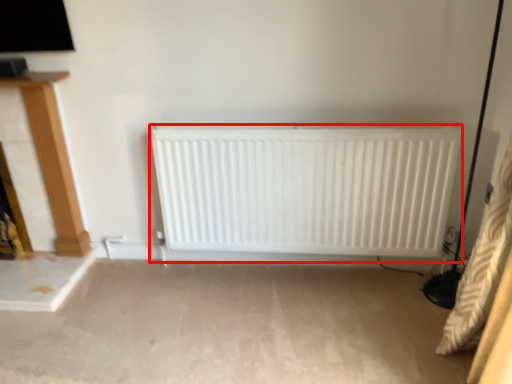
Question: From the image's perspective, where is radiator (annotated by the red box) located in relation to furniture in the image?

Choices:
 (A) below
 (B) above

Answer: (A)